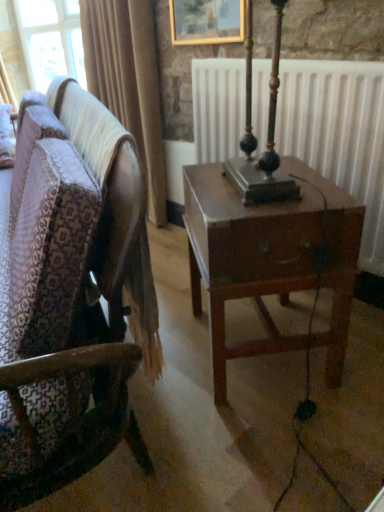
At what (x,y) coordinates should I click in order to perform the action: click on white matte radiator at center. Please return your answer as a coordinate pair (x, y). Image resolution: width=384 pixels, height=512 pixels. Looking at the image, I should click on (339, 134).

I want to click on gold-framed painting at upper center, so click(206, 21).

Considering the relative sizes of wooden chair at center and white matte radiator at center in the image provided, is wooden chair at center smaller than white matte radiator at center?

No.

Is point (94, 316) farther from camera compared to point (205, 134)?

No, it is not.

Which is more to the left, wooden chair at center or white matte radiator at center?

wooden chair at center.

Is wooden chair at center to the left or to the right of gold-framed painting at upper center in the image?

wooden chair at center is positioned on gold-framed painting at upper center's left side.

The height and width of the screenshot is (512, 384). I want to click on chair that appears below the gold-framed painting at upper center (from the image's perspective), so click(65, 297).

From the image's perspective, does wooden chair at center appear lower than gold-framed painting at upper center?

Yes, from the image's perspective, wooden chair at center is beneath gold-framed painting at upper center.

Consider the image. Is wooden chair at center next to gold-framed painting at upper center?

wooden chair at center and gold-framed painting at upper center are not in contact.

Does white matte radiator at center have a larger size compared to wooden chair at center?

Incorrect, white matte radiator at center is not larger than wooden chair at center.

How different are the orientations of white matte radiator at center and wooden chair at center in degrees?

There is a 21.5-degree angle between the facing directions of white matte radiator at center and wooden chair at center.

Is point (206, 68) closer to camera compared to point (61, 256)?

No, (206, 68) is further to viewer.

Is white matte radiator at center oriented towards wooden chair at center?

Yes.

From a real-world perspective, relative to wooden chair at center, is gold-framed painting at upper center vertically above or below?

gold-framed painting at upper center is situated higher than wooden chair at center in the real world.

In order to click on chair on the left of gold-framed painting at upper center in this screenshot , I will do `click(65, 297)`.

How many degrees apart are the facing directions of gold-framed painting at upper center and wooden chair at center?

The facing directions of gold-framed painting at upper center and wooden chair at center are 23.4 degrees apart.

Is point (197, 40) in front of point (43, 196)?

That is False.

Based on the photo, looking at the image, does gold-framed painting at upper center seem bigger or smaller compared to white matte radiator at center?

gold-framed painting at upper center is smaller than white matte radiator at center.

Is gold-framed painting at upper center oriented towards white matte radiator at center?

No, gold-framed painting at upper center is not facing towards white matte radiator at center.

Considering the sizes of gold-framed painting at upper center and white matte radiator at center in the image, is gold-framed painting at upper center wider or thinner than white matte radiator at center?

Considering their sizes, gold-framed painting at upper center looks slimmer than white matte radiator at center.

Who is shorter, white matte radiator at center or gold-framed painting at upper center?

Standing shorter between the two is gold-framed painting at upper center.

Considering the sizes of objects white matte radiator at center and gold-framed painting at upper center in the image provided, who is wider, white matte radiator at center or gold-framed painting at upper center?

Wider between the two is white matte radiator at center.

Is the surface of white matte radiator at center in direct contact with gold-framed painting at upper center?

There is a gap between white matte radiator at center and gold-framed painting at upper center.

Is white matte radiator at center oriented away from gold-framed painting at upper center?

No, white matte radiator at center is not facing the opposite direction of gold-framed painting at upper center.

Identify the location of chair on the left of the white matte radiator at center. This screenshot has height=512, width=384. (65, 297).

In order to click on chair that is in front of the gold-framed painting at upper center in this screenshot , I will do `click(65, 297)`.

Considering their positions, is gold-framed painting at upper center positioned further to wooden chair at center than white matte radiator at center?

The object further to wooden chair at center is gold-framed painting at upper center.

Considering their positions, is wooden chair at center positioned further to gold-framed painting at upper center than white matte radiator at center?

wooden chair at center is positioned further to the anchor gold-framed painting at upper center.

When comparing their distances from wooden chair at center, does white matte radiator at center or gold-framed painting at upper center seem further?

Among the two, gold-framed painting at upper center is located further to wooden chair at center.

Considering their positions, is gold-framed painting at upper center positioned closer to white matte radiator at center than wooden chair at center?

gold-framed painting at upper center is positioned closer to the anchor white matte radiator at center.

Considering their positions, is wooden chair at center positioned further to white matte radiator at center than gold-framed painting at upper center?

wooden chair at center lies further to white matte radiator at center than the other object.

When comparing their distances from gold-framed painting at upper center, does white matte radiator at center or wooden chair at center seem closer?

The object closer to gold-framed painting at upper center is white matte radiator at center.

Locate an element on the screen. radiator between wooden chair at center and gold-framed painting at upper center in the front-back direction is located at coordinates (339, 134).